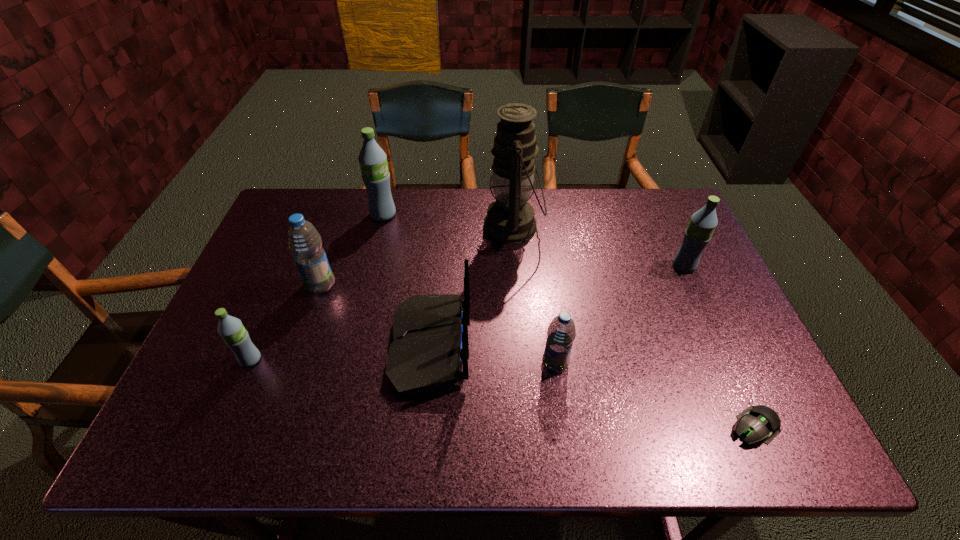
The width and height of the screenshot is (960, 540). I want to click on oil lamp, so click(510, 219).

This screenshot has width=960, height=540. What are the coordinates of `the second green water bottle from right to left` in the screenshot? It's located at (373, 163).

At what (x,y) coordinates should I click in order to perform the action: click on the tallest water bottle. Please return your answer as a coordinate pair (x, y). Looking at the image, I should click on (373, 163).

At what (x,y) coordinates should I click in order to perform the action: click on the second water bottle from left to right. Please return your answer as a coordinate pair (x, y). Looking at the image, I should click on (303, 240).

Where is `the bigger blue water bottle`? the bigger blue water bottle is located at coordinates (303, 240).

This screenshot has height=540, width=960. I want to click on the second farthest green water bottle, so (702, 224).

Find the location of a particular element. the rightmost green water bottle is located at coordinates (702, 224).

At what (x,y) coordinates should I click in order to perform the action: click on the fourth object from left to right. Please return your answer as a coordinate pair (x, y). The image size is (960, 540). Looking at the image, I should click on (430, 332).

Where is `black router`? This screenshot has width=960, height=540. black router is located at coordinates (430, 332).

I want to click on the fourth water bottle from left to right, so click(561, 333).